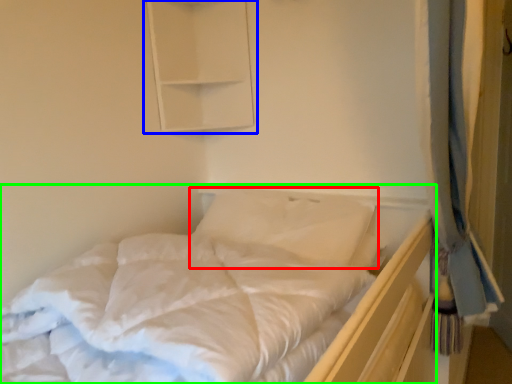
Question: Which is farther away from pillow (highlighted by a red box)? medicine cabinet (highlighted by a blue box) or bed (highlighted by a green box)?

Choices:
 (A) medicine cabinet
 (B) bed

Answer: (A)